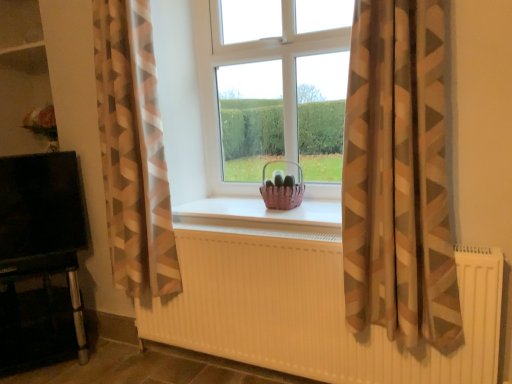
Locate an element on the screen. vacant region to the left of pink woven basket at center is located at coordinates pyautogui.click(x=241, y=209).